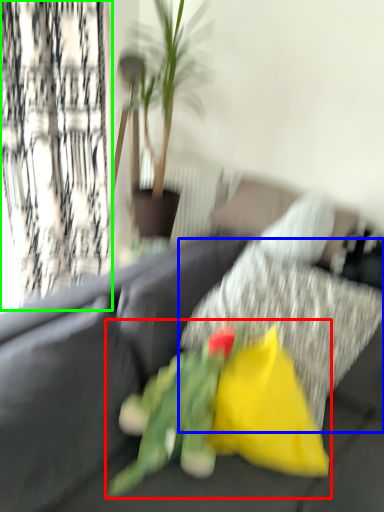
Question: Which object is the closest to the floral arrangement (highlighted by a red box)? Choose among these: pillow (highlighted by a blue box) or curtain (highlighted by a green box).

Choices:
 (A) pillow
 (B) curtain

Answer: (A)